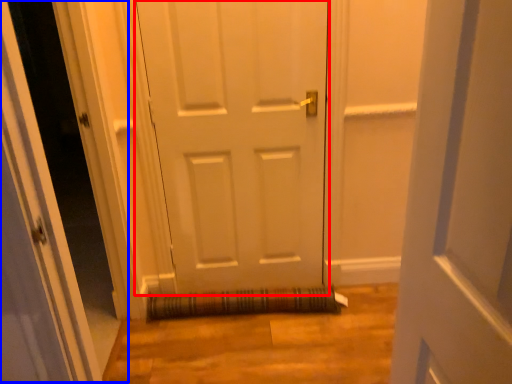
Question: Which point is closer to the camera, door (highlighted by a red box) or glass door (highlighted by a blue box)?

Choices:
 (A) door
 (B) glass door

Answer: (B)